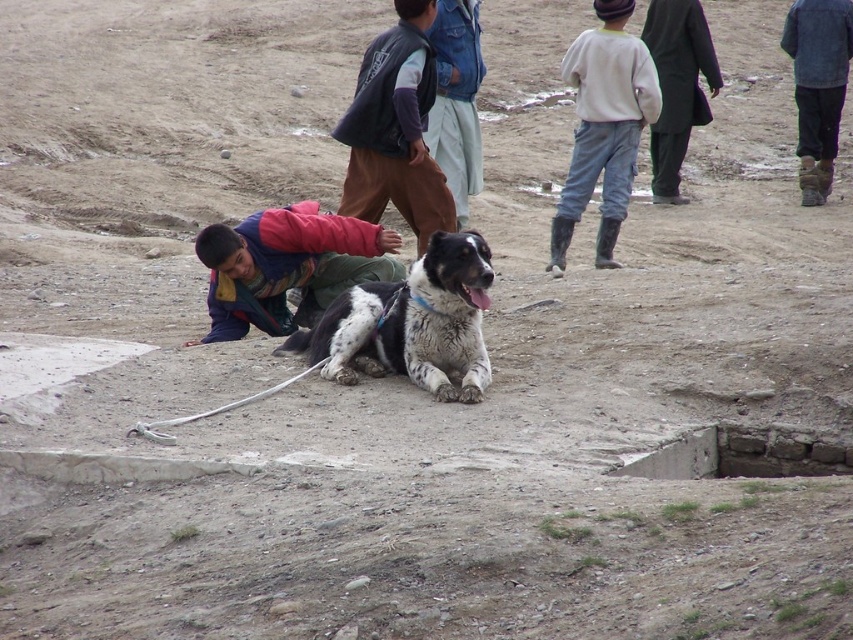
Between spotted fur dog at center and light gray cotton pants at upper center, which one appears on the left side from the viewer's perspective?

spotted fur dog at center is more to the left.

Can you confirm if spotted fur dog at center is bigger than light gray cotton pants at upper center?

Yes, spotted fur dog at center is bigger than light gray cotton pants at upper center.

Is point (433, 241) less distant than point (611, 237)?

Yes, point (433, 241) is in front of point (611, 237).

Find the location of `spotted fur dog at center`. spotted fur dog at center is located at coordinates (410, 323).

Between point (360, 76) and point (654, 108), which one is positioned behind?

The point (654, 108) is behind.

Can you confirm if dark brown fabric vest at center is thinner than light gray cotton pants at upper center?

Indeed, dark brown fabric vest at center has a lesser width compared to light gray cotton pants at upper center.

Measure the distance between point (432, 72) and camera.

The distance of point (432, 72) from camera is 10.47 meters.

In order to click on dark brown fabric vest at center in this screenshot , I will do `click(395, 129)`.

Which of these two, multicolored fleece jacket at lower left or dark brown fabric vest at center, stands taller?

multicolored fleece jacket at lower left

The width and height of the screenshot is (853, 640). What do you see at coordinates (288, 266) in the screenshot? I see `multicolored fleece jacket at lower left` at bounding box center [288, 266].

I want to click on multicolored fleece jacket at lower left, so click(288, 266).